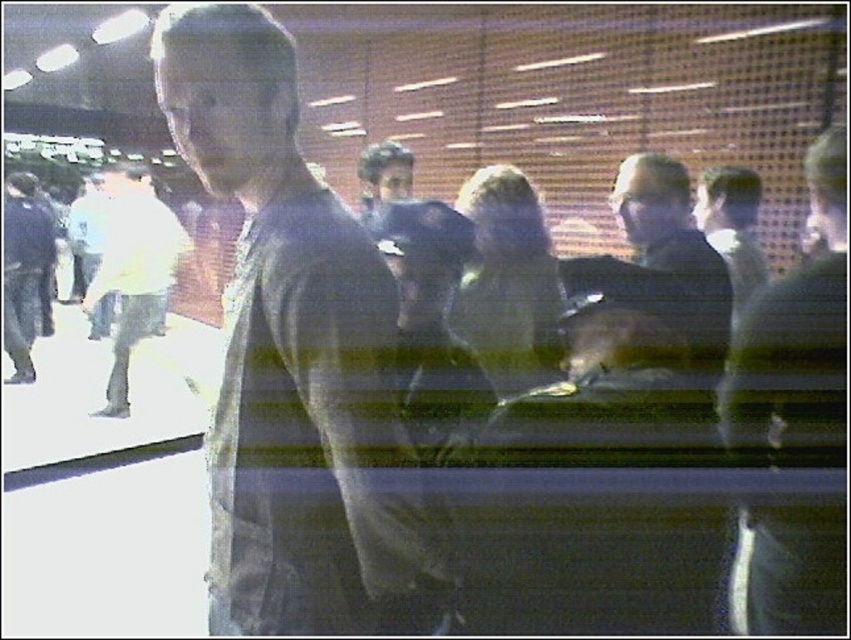
Question: Is dark gray shirt at center positioned in front of white matte shirt at left?

Choices:
 (A) yes
 (B) no

Answer: (A)

Question: Is dark gray shirt at center above white matte shirt at left?

Choices:
 (A) no
 (B) yes

Answer: (A)

Question: Does dark gray shirt at center have a lesser width compared to white matte shirt at left?

Choices:
 (A) yes
 (B) no

Answer: (A)